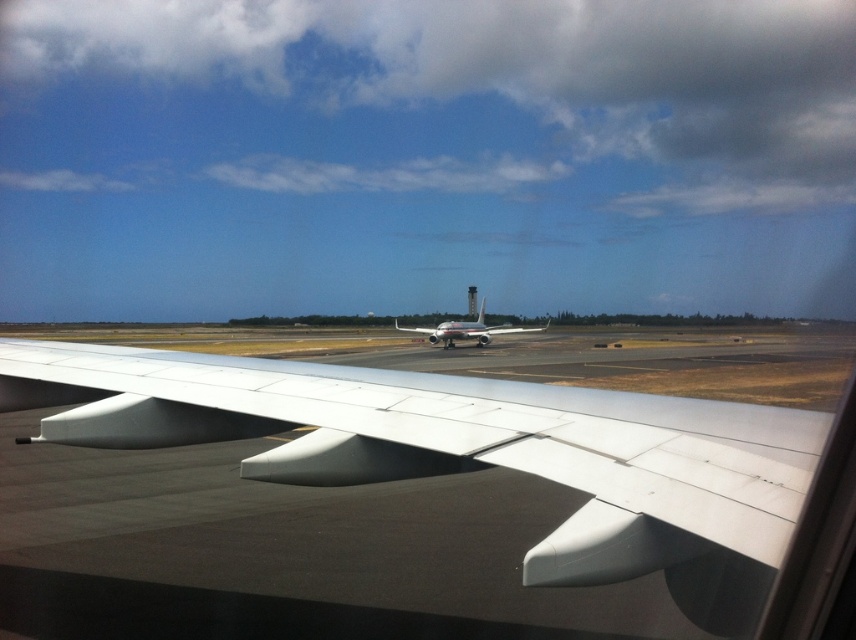
Question: Observing the image, what is the correct spatial positioning of white matte wing at center in reference to silver metallic airplane at center?

Choices:
 (A) left
 (B) right

Answer: (A)

Question: Is white matte wing at center to the right of silver metallic airplane at center from the viewer's perspective?

Choices:
 (A) yes
 (B) no

Answer: (B)

Question: Which point is farther to the camera?

Choices:
 (A) coord(492,326)
 (B) coord(610,541)

Answer: (A)

Question: Does white matte wing at center appear over silver metallic airplane at center?

Choices:
 (A) yes
 (B) no

Answer: (B)

Question: Among these objects, which one is farthest from the camera?

Choices:
 (A) silver metallic airplane at center
 (B) white matte wing at center

Answer: (A)